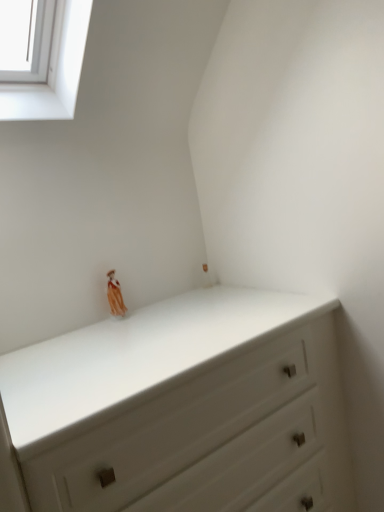
Question: Considering the positions of point (66, 62) and point (117, 289), is point (66, 62) closer or farther from the camera than point (117, 289)?

Choices:
 (A) closer
 (B) farther

Answer: (A)

Question: From their relative heights in the image, would you say white glass window at upper left is taller or shorter than matte orange figurine at upper center?

Choices:
 (A) tall
 (B) short

Answer: (A)

Question: Based on their relative distances, which object is farther from the white matte chest of drawers at center?

Choices:
 (A) white glass window at upper left
 (B) matte orange figurine at upper center

Answer: (A)

Question: Which object is positioned closest to the white glass window at upper left?

Choices:
 (A) matte orange figurine at upper center
 (B) white matte chest of drawers at center

Answer: (A)